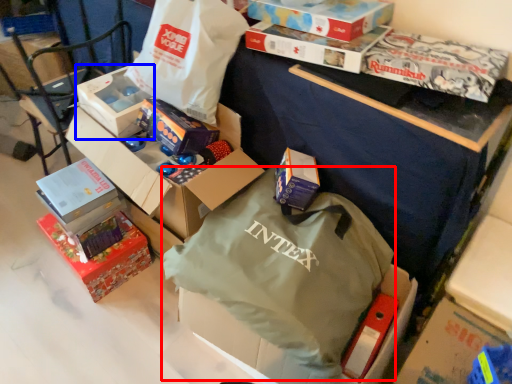
Question: Which object is closer to the camera taking this photo, bag (highlighted by a red box) or box (highlighted by a blue box)?

Choices:
 (A) bag
 (B) box

Answer: (A)